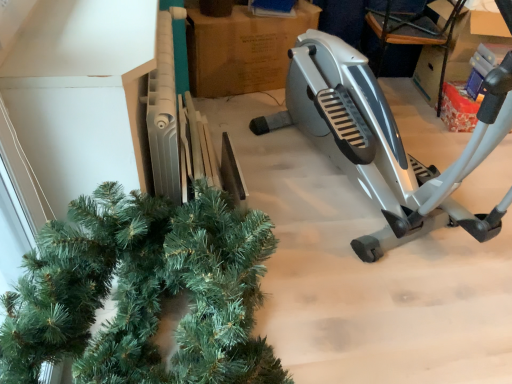
Question: From a real-world perspective, is brown cardboard at center over silver metallic stationary bicycle at right?

Choices:
 (A) no
 (B) yes

Answer: (A)

Question: Is brown cardboard at center positioned behind silver metallic stationary bicycle at right?

Choices:
 (A) yes
 (B) no

Answer: (A)

Question: Considering the relative sizes of brown cardboard at center and silver metallic stationary bicycle at right in the image provided, is brown cardboard at center smaller than silver metallic stationary bicycle at right?

Choices:
 (A) yes
 (B) no

Answer: (A)

Question: Is brown cardboard at center at the left side of silver metallic stationary bicycle at right?

Choices:
 (A) no
 (B) yes

Answer: (B)

Question: Can you confirm if brown cardboard at center is thinner than silver metallic stationary bicycle at right?

Choices:
 (A) no
 (B) yes

Answer: (B)

Question: Is brown cardboard at center shorter than silver metallic stationary bicycle at right?

Choices:
 (A) no
 (B) yes

Answer: (B)

Question: Considering the relative sizes of silver metallic stationary bicycle at right and brown cardboard at center in the image provided, is silver metallic stationary bicycle at right wider than brown cardboard at center?

Choices:
 (A) yes
 (B) no

Answer: (A)

Question: Is silver metallic stationary bicycle at right completely or partially outside of brown cardboard at center?

Choices:
 (A) no
 (B) yes

Answer: (B)

Question: Is silver metallic stationary bicycle at right taller than brown cardboard at center?

Choices:
 (A) yes
 (B) no

Answer: (A)

Question: Is silver metallic stationary bicycle at right beside brown cardboard at center?

Choices:
 (A) yes
 (B) no

Answer: (B)

Question: Is brown cardboard at center a part of silver metallic stationary bicycle at right?

Choices:
 (A) yes
 (B) no

Answer: (B)

Question: Is silver metallic stationary bicycle at right in front of brown cardboard at center?

Choices:
 (A) no
 (B) yes

Answer: (B)

Question: From a real-world perspective, is silver metallic stationary bicycle at right above or below brown cardboard at center?

Choices:
 (A) below
 (B) above

Answer: (B)